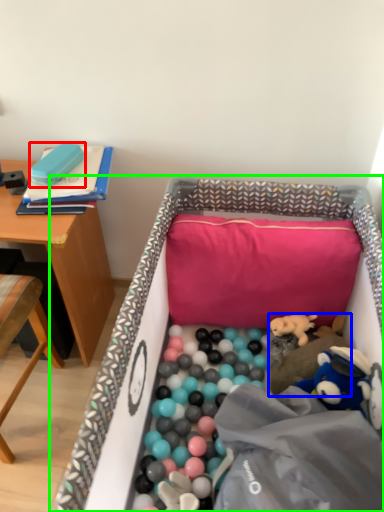
Question: Estimate the real-world distances between objects in this image. Which object is farther from toy (highlighted by a red box), toy (highlighted by a blue box) or infant bed (highlighted by a green box)?

Choices:
 (A) toy
 (B) infant bed

Answer: (A)